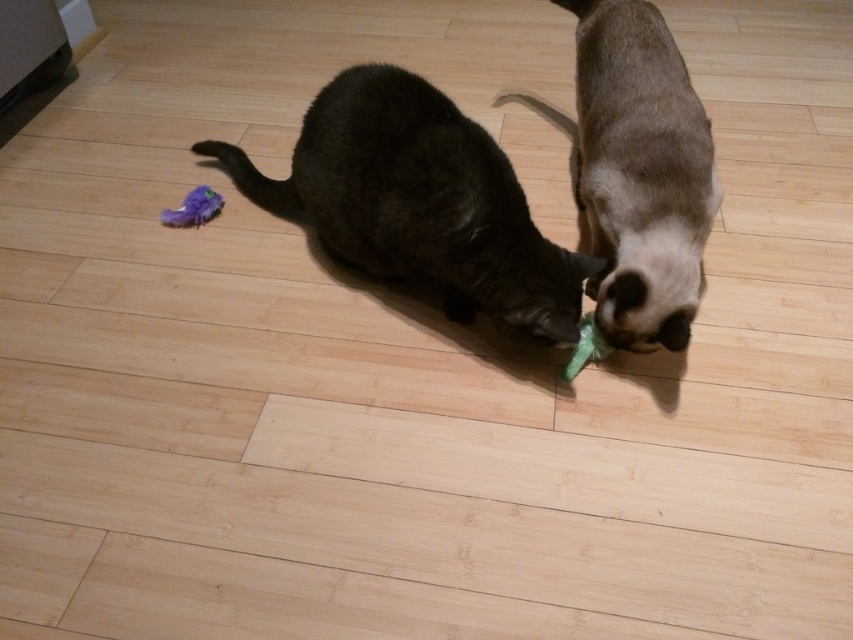
Is point (531, 232) more distant than point (664, 257)?

Yes, point (531, 232) is behind point (664, 257).

Does dark brown fur cat at center have a lesser height compared to satin fur cat at center?

Indeed, dark brown fur cat at center has a lesser height compared to satin fur cat at center.

Measure the distance between dark brown fur cat at center and camera.

5.25 feet

Where is `dark brown fur cat at center`? dark brown fur cat at center is located at coordinates (419, 202).